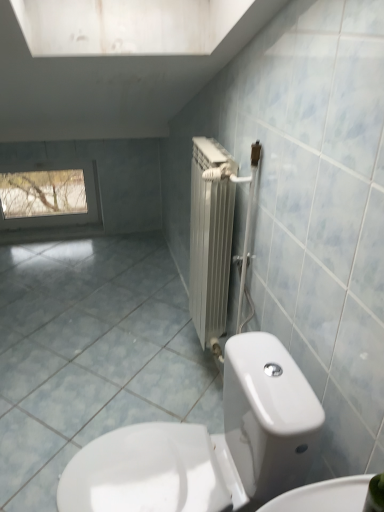
Question: Considering the relative positions of white glossy toilet at lower center and clear glass window at upper left in the image provided, is white glossy toilet at lower center behind clear glass window at upper left?

Choices:
 (A) no
 (B) yes

Answer: (A)

Question: Is white glossy toilet at lower center located outside clear glass window at upper left?

Choices:
 (A) no
 (B) yes

Answer: (B)

Question: Considering the relative positions of white glossy toilet at lower center and clear glass window at upper left in the image provided, is white glossy toilet at lower center in front of clear glass window at upper left?

Choices:
 (A) no
 (B) yes

Answer: (B)

Question: Is white glossy toilet at lower center bigger than clear glass window at upper left?

Choices:
 (A) yes
 (B) no

Answer: (A)

Question: Could you tell me if white glossy toilet at lower center is turned towards clear glass window at upper left?

Choices:
 (A) yes
 (B) no

Answer: (B)

Question: In terms of size, does white glossy toilet at lower center appear bigger or smaller than clear glass window at upper left?

Choices:
 (A) small
 (B) big

Answer: (B)

Question: Is white glossy toilet at lower center taller or shorter than clear glass window at upper left?

Choices:
 (A) short
 (B) tall

Answer: (B)

Question: Is white glossy toilet at lower center wider or thinner than clear glass window at upper left?

Choices:
 (A) thin
 (B) wide

Answer: (B)

Question: Is white glossy toilet at lower center spatially inside clear glass window at upper left, or outside of it?

Choices:
 (A) inside
 (B) outside

Answer: (B)

Question: Is blue glossy tile at center wider or thinner than clear glass window at upper left?

Choices:
 (A) wide
 (B) thin

Answer: (A)

Question: Is blue glossy tile at center situated inside clear glass window at upper left or outside?

Choices:
 (A) outside
 (B) inside

Answer: (A)

Question: From the image's perspective, is blue glossy tile at center positioned above or below clear glass window at upper left?

Choices:
 (A) above
 (B) below

Answer: (B)

Question: Considering the positions of point (157, 409) and point (29, 183), is point (157, 409) closer or farther from the camera than point (29, 183)?

Choices:
 (A) farther
 (B) closer

Answer: (B)

Question: Is clear glass window at upper left inside or outside of white glossy toilet at lower center?

Choices:
 (A) outside
 (B) inside

Answer: (A)

Question: Looking at their shapes, would you say clear glass window at upper left is wider or thinner than white glossy toilet at lower center?

Choices:
 (A) wide
 (B) thin

Answer: (B)